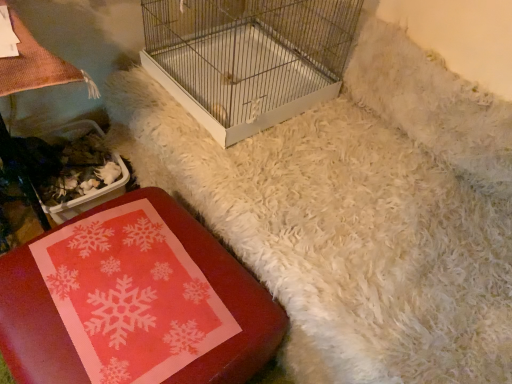
Measure the distance between matte red tray at lower left and camera.

A distance of 31.95 inches exists between matte red tray at lower left and camera.

Where is `matte red tray at lower left`? The height and width of the screenshot is (384, 512). matte red tray at lower left is located at coordinates (133, 302).

The image size is (512, 384). What do you see at coordinates (133, 302) in the screenshot? I see `matte red tray at lower left` at bounding box center [133, 302].

At what (x,y) coordinates should I click in order to perform the action: click on white matte birdcage at center. Please return your answer as a coordinate pair (x, y). Looking at the image, I should click on (248, 58).

This screenshot has height=384, width=512. What do you see at coordinates (248, 58) in the screenshot?
I see `white matte birdcage at center` at bounding box center [248, 58].

This screenshot has height=384, width=512. In order to click on matte red tray at lower left in this screenshot , I will do `click(133, 302)`.

Considering the positions of objects matte red tray at lower left and white matte birdcage at center in the image provided, who is more to the left, matte red tray at lower left or white matte birdcage at center?

Positioned to the left is matte red tray at lower left.

Looking at this image, in the image, is matte red tray at lower left positioned in front of or behind white matte birdcage at center?

matte red tray at lower left is in front of white matte birdcage at center.

Considering the positions of points (111, 268) and (231, 130), is point (111, 268) farther from camera compared to point (231, 130)?

No, it is not.

From the image's perspective, which object appears higher, matte red tray at lower left or white matte birdcage at center?

white matte birdcage at center appears higher in the image.

From a real-world perspective, who is located higher, matte red tray at lower left or white matte birdcage at center?

From a 3D spatial view, white matte birdcage at center is above.

Does matte red tray at lower left have a greater width compared to white matte birdcage at center?

Incorrect, the width of matte red tray at lower left does not surpass that of white matte birdcage at center.

Which of these two, matte red tray at lower left or white matte birdcage at center, stands taller?

With more height is white matte birdcage at center.

Considering the sizes of matte red tray at lower left and white matte birdcage at center in the image, is matte red tray at lower left bigger or smaller than white matte birdcage at center?

In the image, matte red tray at lower left appears to be larger than white matte birdcage at center.

Looking at this image, would you say matte red tray at lower left is inside or outside white matte birdcage at center?

matte red tray at lower left cannot be found inside white matte birdcage at center.

Is matte red tray at lower left positioned far away from white matte birdcage at center?

matte red tray at lower left is actually quite close to white matte birdcage at center.

Is matte red tray at lower left positioned with its back to white matte birdcage at center?

→ No, matte red tray at lower left's orientation is not away from white matte birdcage at center.

What's the angular difference between matte red tray at lower left and white matte birdcage at center's facing directions?

There is a 3.77-degree angle between the facing directions of matte red tray at lower left and white matte birdcage at center.

You are a GUI agent. You are given a task and a screenshot of the screen. Output one action in this format:
    pyautogui.click(x=<x>, y=<y>)
    Task: Click on the bird cage behind the matte red tray at lower left
    The width and height of the screenshot is (512, 384).
    Given the screenshot: What is the action you would take?
    pyautogui.click(x=248, y=58)

In the image, is white matte birdcage at center on the left side or the right side of matte red tray at lower left?

white matte birdcage at center is to the right of matte red tray at lower left.

Which object is further away from the camera taking this photo, white matte birdcage at center or matte red tray at lower left?

white matte birdcage at center.

Is point (322, 30) in front of point (140, 218)?

No, it is behind (140, 218).

From the image's perspective, is white matte birdcage at center over matte red tray at lower left?

Yes.

From a real-world perspective, does white matte birdcage at center sit lower than matte red tray at lower left?

No, from a real-world perspective, white matte birdcage at center is not beneath matte red tray at lower left.

Considering the sizes of objects white matte birdcage at center and matte red tray at lower left in the image provided, who is wider, white matte birdcage at center or matte red tray at lower left?

With larger width is white matte birdcage at center.

Between white matte birdcage at center and matte red tray at lower left, which one has less height?

With less height is matte red tray at lower left.

Is white matte birdcage at center bigger or smaller than matte red tray at lower left?

In the image, white matte birdcage at center appears to be smaller than matte red tray at lower left.

Is white matte birdcage at center not inside matte red tray at lower left?

That's correct, white matte birdcage at center is outside of matte red tray at lower left.

Is white matte birdcage at center not close to matte red tray at lower left?

No, there isn't a large distance between white matte birdcage at center and matte red tray at lower left.

Could you tell me if white matte birdcage at center is facing matte red tray at lower left?

No, white matte birdcage at center is not turned towards matte red tray at lower left.

How many degrees apart are the facing directions of white matte birdcage at center and matte red tray at lower left?

There is a 3.77-degree angle between the facing directions of white matte birdcage at center and matte red tray at lower left.

In the image, there is a white matte birdcage at center. Where is `furniture below it (from the image's perspective)`? The width and height of the screenshot is (512, 384). furniture below it (from the image's perspective) is located at coordinates (133, 302).

Find the location of `furniture below the white matte birdcage at center (from a real-world perspective)`. furniture below the white matte birdcage at center (from a real-world perspective) is located at coordinates (133, 302).

This screenshot has height=384, width=512. What are the coordinates of `bird cage that is above the matte red tray at lower left (from a real-world perspective)` in the screenshot? It's located at (x=248, y=58).